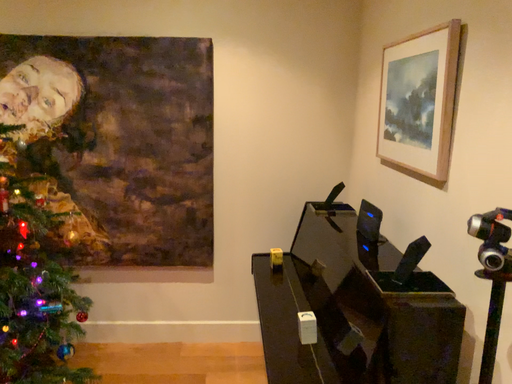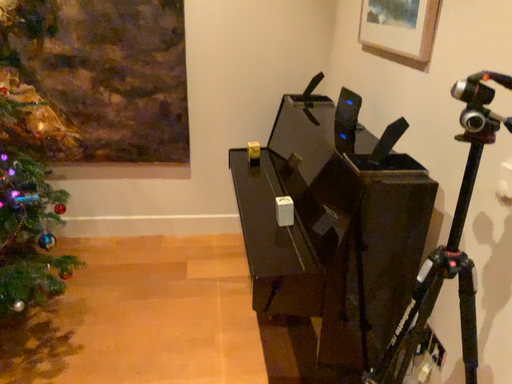
Question: Which way did the camera rotate in the video?

Choices:
 (A) rotated downward
 (B) rotated upward

Answer: (A)